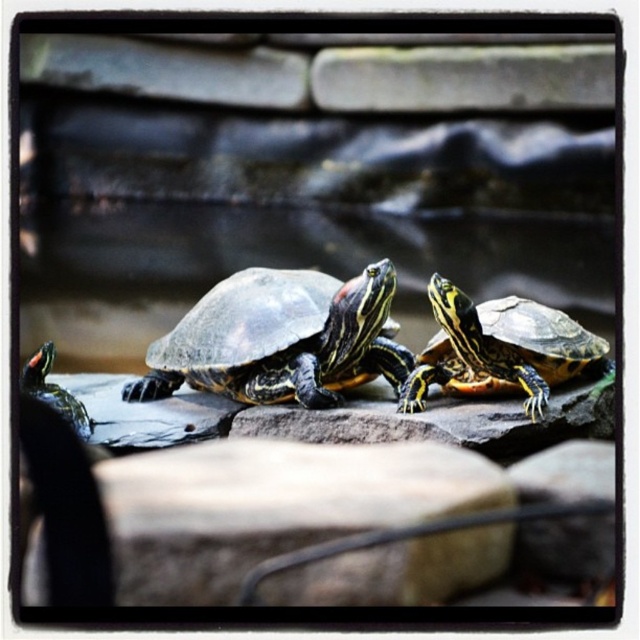
Question: Can you confirm if shiny green tortoise at center is positioned to the right of shiny green tortoise at lower left?

Choices:
 (A) yes
 (B) no

Answer: (A)

Question: Is shiny green tortoise at center thinner than shiny green tortoise at lower left?

Choices:
 (A) yes
 (B) no

Answer: (B)

Question: Estimate the real-world distances between objects in this image. Which object is closer to the shiny green tortoise at lower left?

Choices:
 (A) shiny green shell at center
 (B) shiny green tortoise at center

Answer: (B)

Question: Estimate the real-world distances between objects in this image. Which object is closer to the shiny green tortoise at center?

Choices:
 (A) shiny green tortoise at lower left
 (B) shiny green shell at center

Answer: (B)

Question: Which point is closer to the camera taking this photo?

Choices:
 (A) click(276, 339)
 (B) click(506, 346)
 (C) click(44, 348)

Answer: (B)

Question: Is shiny green tortoise at center positioned before shiny green shell at center?

Choices:
 (A) no
 (B) yes

Answer: (A)